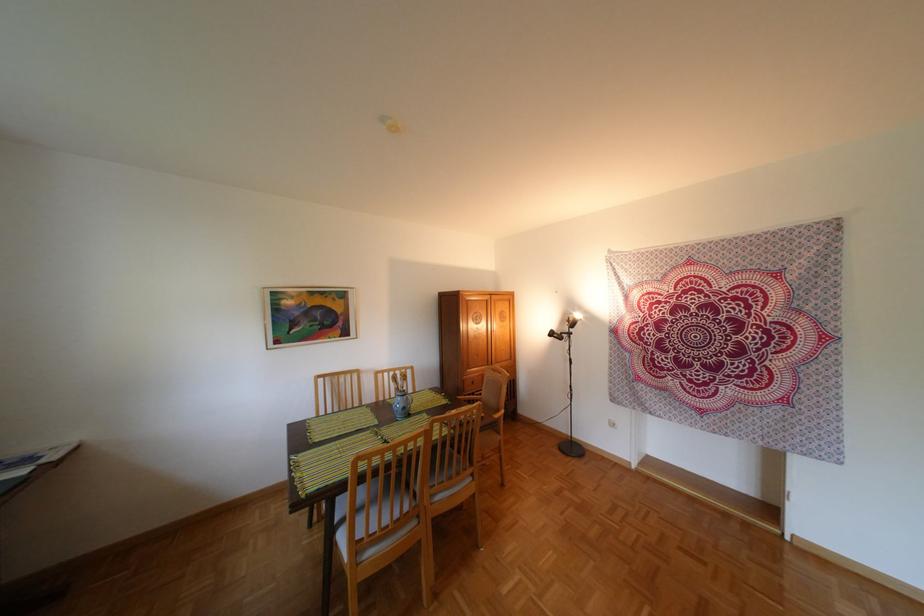
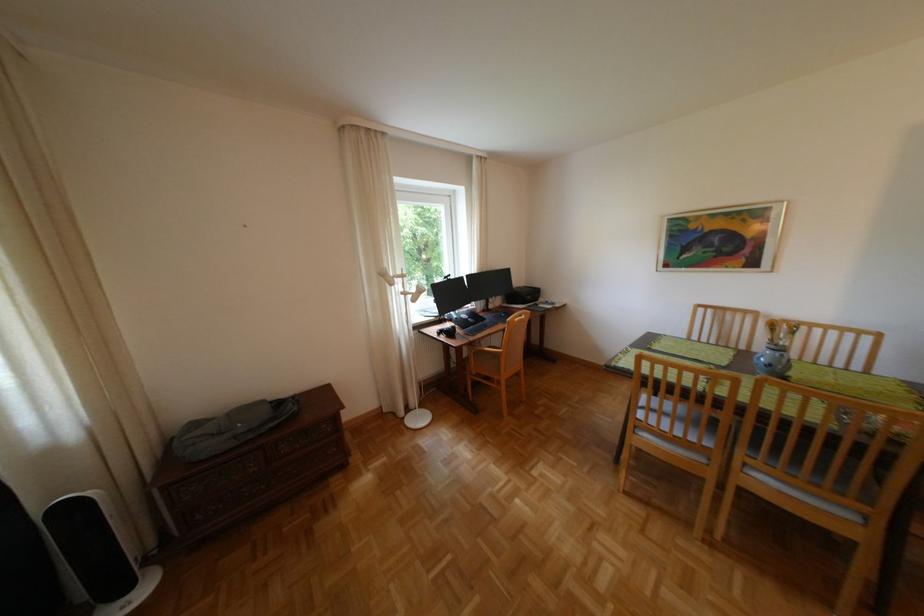
Where in the second image is the point corresponding to the point at 386,528 from the first image?

(666, 422)